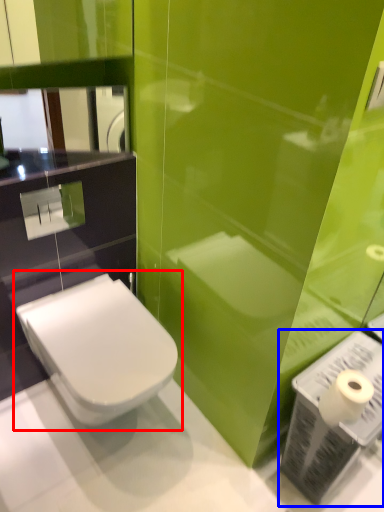
Question: Which point is further to the camera, toilet (highlighted by a red box) or toiletry (highlighted by a blue box)?

Choices:
 (A) toilet
 (B) toiletry

Answer: (A)